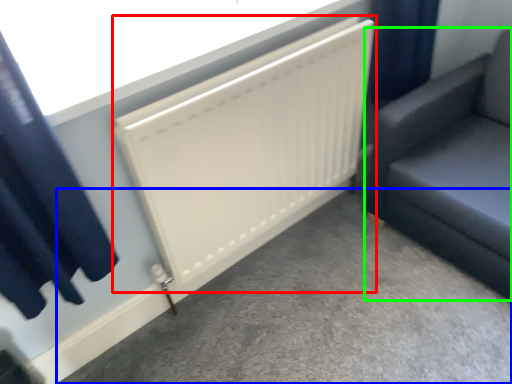
Question: Which object is positioned closest to radiator (highlighted by a red box)? Select from concrete (highlighted by a blue box) and furniture (highlighted by a green box).

Choices:
 (A) concrete
 (B) furniture

Answer: (B)